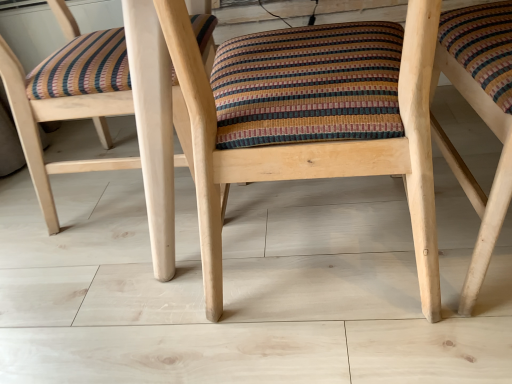
Locate an element on the screen. The image size is (512, 384). vacant region to the left of wooden chair at center, which appears as the 2th chair when viewed from the left is located at coordinates (99, 314).